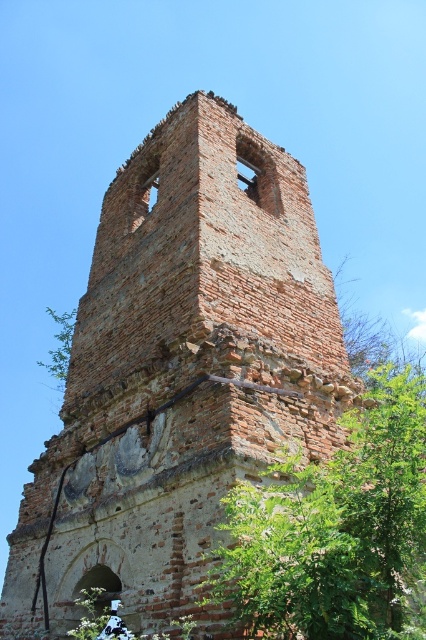
From the picture: Does green leafy tree at center have a lesser width compared to green leafy tree at left?

Correct, green leafy tree at center's width is less than green leafy tree at left's.

Consider the image. Which is below, green leafy tree at center or green leafy tree at left?

green leafy tree at center

The width and height of the screenshot is (426, 640). Find the location of `green leafy tree at center`. green leafy tree at center is located at coordinates (336, 529).